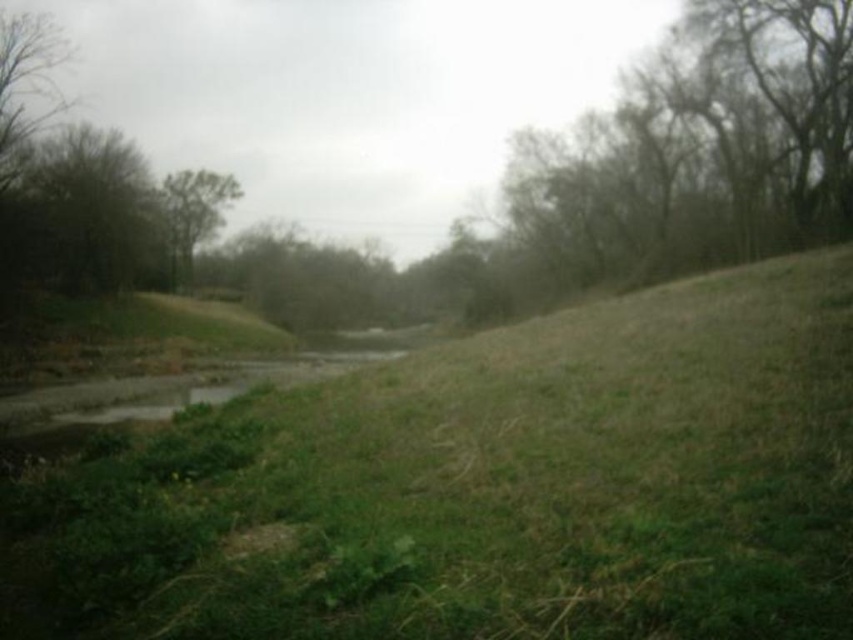
Who is more distant from viewer, (737, 525) or (213, 173)?

The point (213, 173) is more distant.

Who is positioned more to the right, green grass at center or green leafy tree at center?

From the viewer's perspective, green grass at center appears more on the right side.

Locate an element on the screen. The width and height of the screenshot is (853, 640). green grass at center is located at coordinates (485, 486).

Who is positioned more to the left, green grass at center or green leafy tree at upper left?

From the viewer's perspective, green leafy tree at upper left appears more on the left side.

Can you confirm if green grass at center is wider than green leafy tree at upper left?

Indeed, green grass at center has a greater width compared to green leafy tree at upper left.

Who is more distant from viewer, (833, 532) or (49, 275)?

The point (49, 275) is more distant.

You are a GUI agent. You are given a task and a screenshot of the screen. Output one action in this format:
    pyautogui.click(x=<x>, y=<y>)
    Task: Click on the green grass at center
    
    Given the screenshot: What is the action you would take?
    pyautogui.click(x=485, y=486)

Is green leafy tree at upper left thinner than green leafy tree at center?

Indeed, green leafy tree at upper left has a lesser width compared to green leafy tree at center.

Is point (59, 278) positioned after point (173, 218)?

No, it is in front of (173, 218).

This screenshot has height=640, width=853. What do you see at coordinates (90, 214) in the screenshot?
I see `green leafy tree at upper left` at bounding box center [90, 214].

Identify the location of green leafy tree at upper left. This screenshot has height=640, width=853. pos(90,214).